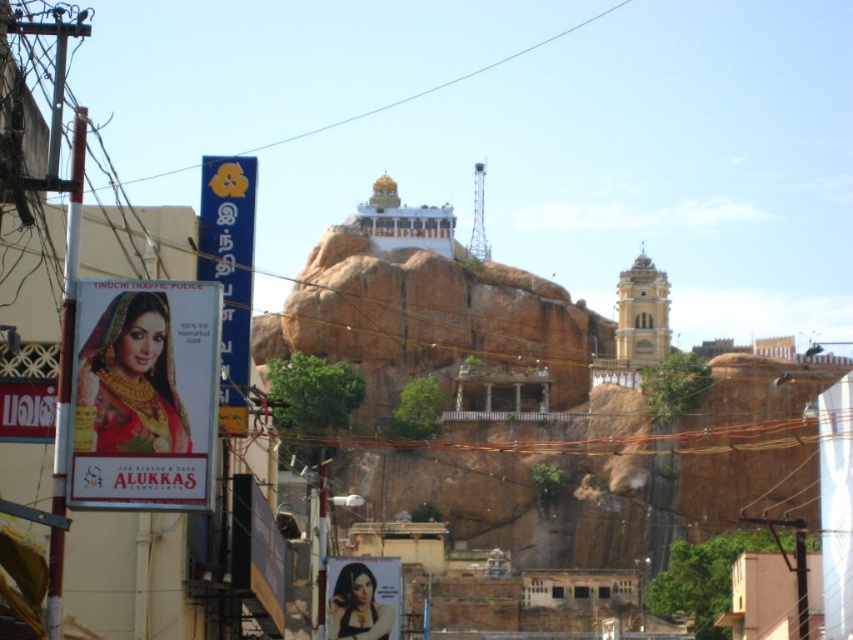
Question: Is matte gold billboard at left positioned at the back of blue plastic sign at left?

Choices:
 (A) no
 (B) yes

Answer: (A)

Question: Is matte gold billboard at left below blue plastic sign at left?

Choices:
 (A) yes
 (B) no

Answer: (A)

Question: Which point appears closest to the camera in this image?

Choices:
 (A) (202, 256)
 (B) (73, 486)

Answer: (B)

Question: Is matte gold billboard at left thinner than blue plastic sign at left?

Choices:
 (A) no
 (B) yes

Answer: (B)

Question: Which of the following is the closest to the observer?

Choices:
 (A) (141, 291)
 (B) (218, 212)

Answer: (A)

Question: Which of the following is the closest to the observer?

Choices:
 (A) blue plastic sign at left
 (B) matte gold billboard at left

Answer: (B)